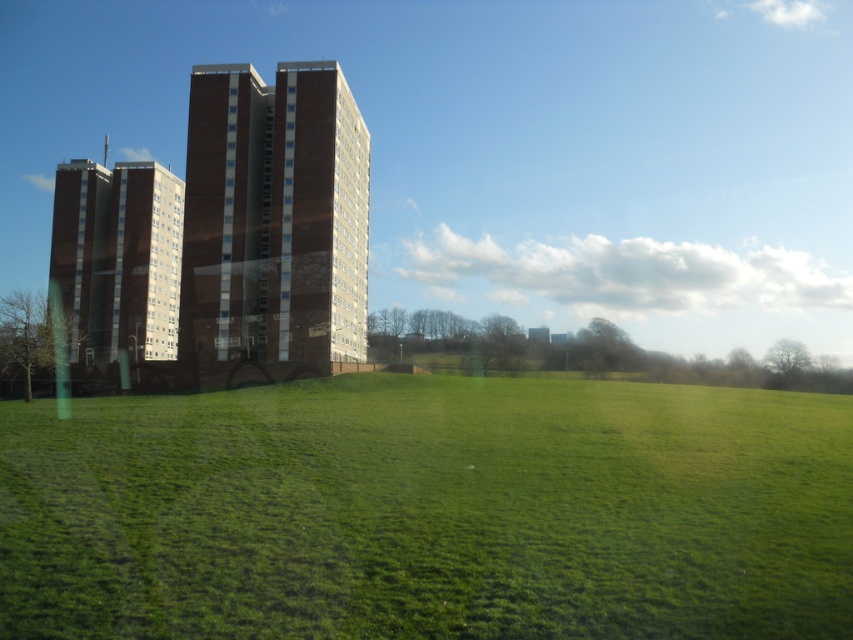
You are a city planner reviewing a proposed development plan. The plan includes constructing a new park between the brown brick building at center and the brown brick building at left. Given the spatial relationship between these two buildings, which building would require less land to be cleared for the park?

The brown brick building at center is smaller than the brown brick building at left, so constructing the park between them would require less land to be cleared near the smaller building at center.